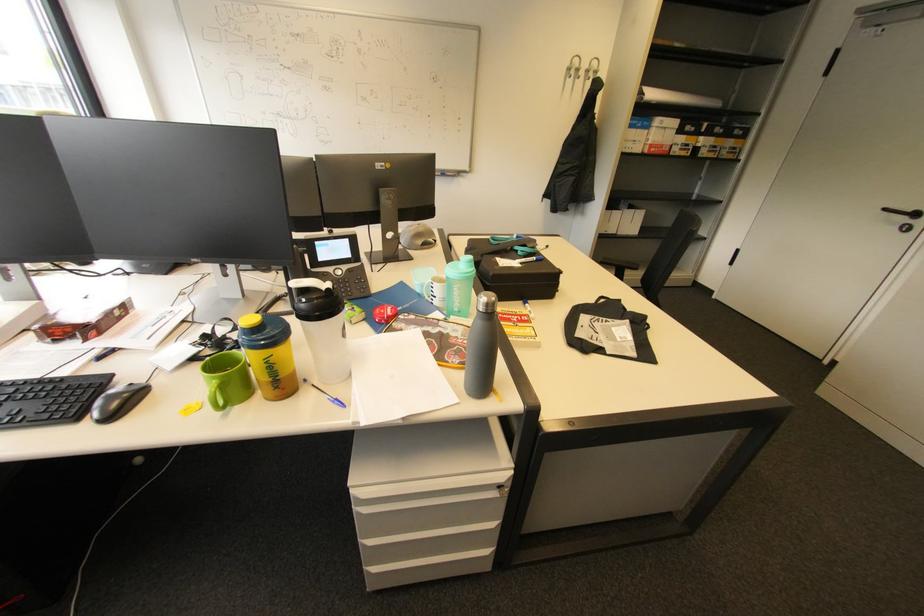
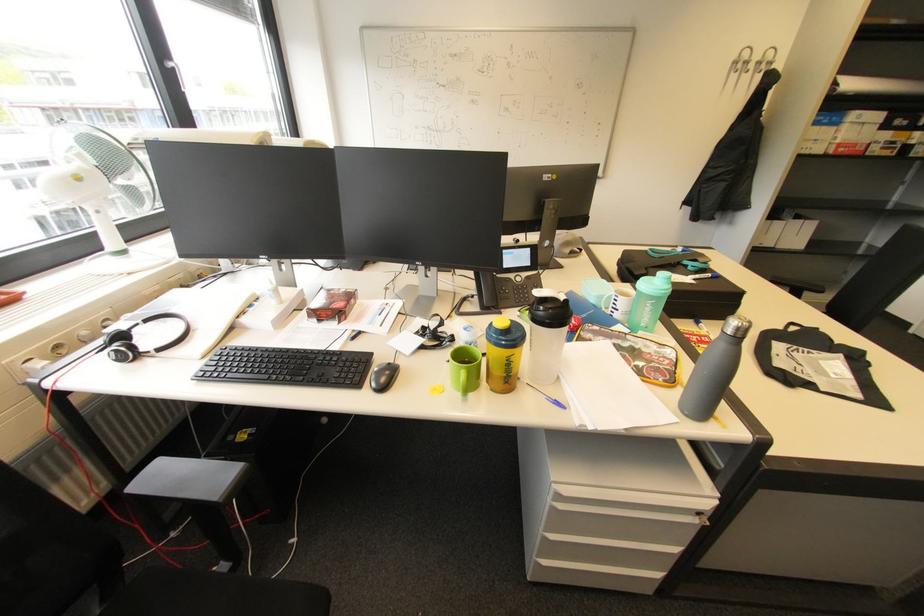
In the second image, find the point that corresponds to pixel 338 403 in the first image.

(558, 403)